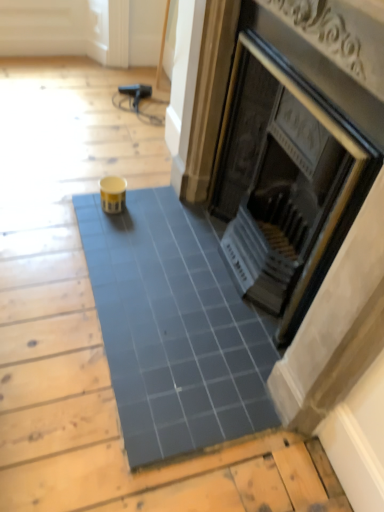
What do you see at coordinates (291, 166) in the screenshot? This screenshot has height=512, width=384. I see `matte black fireplace at center` at bounding box center [291, 166].

Measure the distance between point (258, 18) and camera.

Point (258, 18) is 1.47 meters from camera.

Image resolution: width=384 pixels, height=512 pixels. In order to click on matte black fireplace at center in this screenshot , I will do `click(291, 166)`.

What do you see at coordinates (173, 328) in the screenshot? The image size is (384, 512). I see `blue glossy tile at center` at bounding box center [173, 328].

You are a GUI agent. You are given a task and a screenshot of the screen. Output one action in this format:
    pyautogui.click(x=<x>, y=<y>)
    Task: Click on the blue glossy tile at center
    This screenshot has width=384, height=512.
    Given the screenshot: What is the action you would take?
    pyautogui.click(x=173, y=328)

Find the location of a particular element. The height and width of the screenshot is (512, 384). matte black fireplace at center is located at coordinates (291, 166).

Considering the positions of objects blue glossy tile at center and matte black fireplace at center in the image provided, who is more to the left, blue glossy tile at center or matte black fireplace at center?

From the viewer's perspective, blue glossy tile at center appears more on the left side.

Considering the relative positions of blue glossy tile at center and matte black fireplace at center in the image provided, is blue glossy tile at center behind matte black fireplace at center?

Yes, blue glossy tile at center is behind matte black fireplace at center.

Considering the points (143, 203) and (297, 98), which point is behind, point (143, 203) or point (297, 98)?

The point (143, 203) is farther from the camera.

From the image's perspective, who appears lower, blue glossy tile at center or matte black fireplace at center?

From the image's view, blue glossy tile at center is below.

From a real-world perspective, is blue glossy tile at center on top of matte black fireplace at center?

Incorrect, from a real-world perspective, blue glossy tile at center is lower than matte black fireplace at center.

Does blue glossy tile at center have a greater width compared to matte black fireplace at center?

Yes.

Is blue glossy tile at center taller or shorter than matte black fireplace at center?

Clearly, blue glossy tile at center is shorter compared to matte black fireplace at center.

Based on the photo, looking at the image, does blue glossy tile at center seem bigger or smaller compared to matte black fireplace at center?

Considering their sizes, blue glossy tile at center takes up less space than matte black fireplace at center.

Is blue glossy tile at center inside or outside of matte black fireplace at center?

blue glossy tile at center cannot be found inside matte black fireplace at center.

In the scene shown: Would you say blue glossy tile at center is a long distance from matte black fireplace at center?

No, blue glossy tile at center is in close proximity to matte black fireplace at center.

Is matte black fireplace at center at the back of blue glossy tile at center?

No, matte black fireplace at center is not at the back of blue glossy tile at center.

In the scene shown: How different are the orientations of blue glossy tile at center and matte black fireplace at center in degrees?

There is a 0.98-degree angle between the facing directions of blue glossy tile at center and matte black fireplace at center.

Locate an element on the screen. Image resolution: width=384 pixels, height=512 pixels. fireplace above the blue glossy tile at center (from a real-world perspective) is located at coordinates (291, 166).

Which object is positioned more to the right, matte black fireplace at center or blue glossy tile at center?

matte black fireplace at center is more to the right.

From the picture: Considering the positions of objects matte black fireplace at center and blue glossy tile at center in the image provided, who is behind, matte black fireplace at center or blue glossy tile at center?

Positioned behind is blue glossy tile at center.

Between point (276, 83) and point (186, 380), which one is positioned in front?

The point (186, 380) is closer to the camera.

From the image's perspective, which is above, matte black fireplace at center or blue glossy tile at center?

matte black fireplace at center, from the image's perspective.

From a real-world perspective, between matte black fireplace at center and blue glossy tile at center, who is vertically lower?

From a 3D spatial view, blue glossy tile at center is below.

Looking at their sizes, would you say matte black fireplace at center is wider or thinner than blue glossy tile at center?

Clearly, matte black fireplace at center has less width compared to blue glossy tile at center.

Consider the image. Can you confirm if matte black fireplace at center is shorter than blue glossy tile at center?

In fact, matte black fireplace at center may be taller than blue glossy tile at center.

Between matte black fireplace at center and blue glossy tile at center, which one has smaller size?

blue glossy tile at center.

Choose the correct answer: Is matte black fireplace at center inside blue glossy tile at center or outside it?

matte black fireplace at center lies outside blue glossy tile at center.

Would you consider matte black fireplace at center to be distant from blue glossy tile at center?

No, matte black fireplace at center is not far away from blue glossy tile at center.

Could you tell me if matte black fireplace at center is facing blue glossy tile at center?

Yes.

What's the angular difference between matte black fireplace at center and blue glossy tile at center's facing directions?

matte black fireplace at center and blue glossy tile at center are facing 0.98 degrees away from each other.

Locate an element on the screen. fireplace above the blue glossy tile at center (from the image's perspective) is located at coordinates (291, 166).

Locate an element on the screen. This screenshot has width=384, height=512. fireplace above the blue glossy tile at center (from the image's perspective) is located at coordinates (291, 166).

What are the coordinates of `fireplace above the blue glossy tile at center (from a real-world perspective)` in the screenshot? It's located at (291, 166).